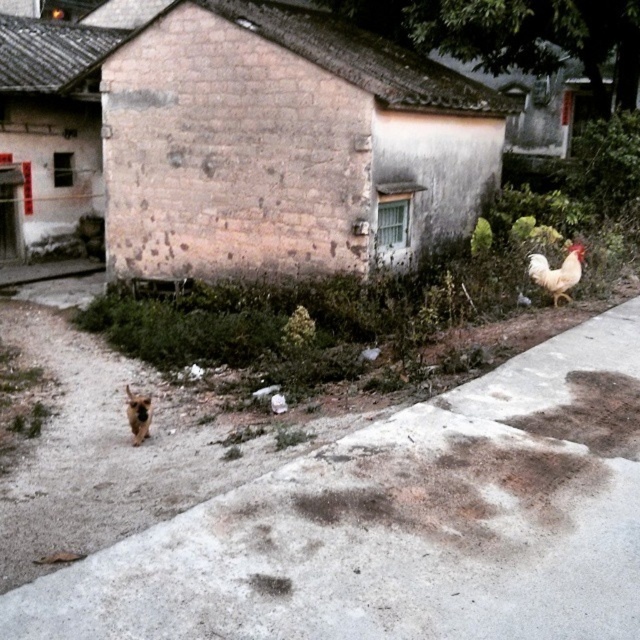
Locate an element on the screen. gray concrete pavement at lower right is located at coordinates (403, 524).

Locate an element on the screen. gray concrete pavement at lower right is located at coordinates (403, 524).

Does white feathered chicken at upper right appear over brown furry dog at lower left?

Yes.

What do you see at coordinates (557, 273) in the screenshot? I see `white feathered chicken at upper right` at bounding box center [557, 273].

Find the location of a particular element. The height and width of the screenshot is (640, 640). white feathered chicken at upper right is located at coordinates (557, 273).

Find the location of a particular element. This screenshot has height=640, width=640. gray concrete pavement at lower right is located at coordinates (403, 524).

Does gray concrete pavement at lower right have a greater width compared to white feathered chicken at upper right?

Yes, gray concrete pavement at lower right is wider than white feathered chicken at upper right.

Is point (596, 572) positioned behind point (579, 269)?

No.

Where is `gray concrete pavement at lower right`? The height and width of the screenshot is (640, 640). gray concrete pavement at lower right is located at coordinates (403, 524).